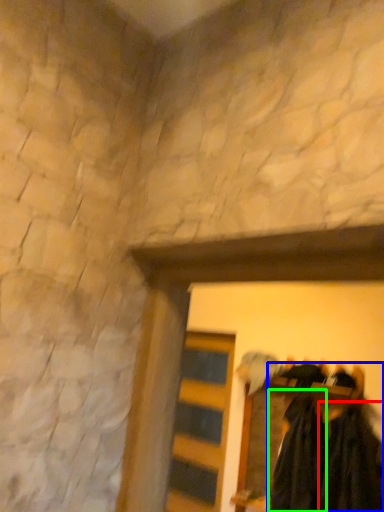
Question: Based on their relative distances, which object is farther from clothing (highlighted by a red box)? Choose from laundry (highlighted by a blue box) and clothing (highlighted by a green box).

Choices:
 (A) laundry
 (B) clothing

Answer: (B)